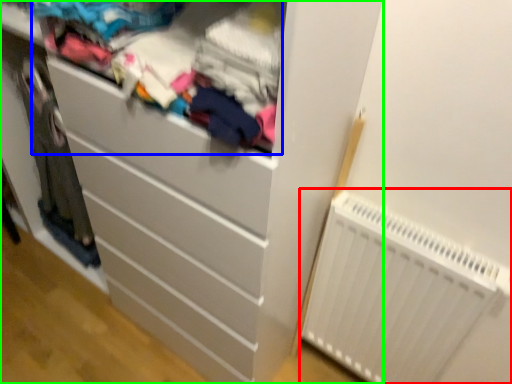
Question: Estimate the real-world distances between objects in this image. Which object is farther from radiator (highlighted by a red box), clothing (highlighted by a blue box) or chest of drawers (highlighted by a green box)?

Choices:
 (A) clothing
 (B) chest of drawers

Answer: (A)